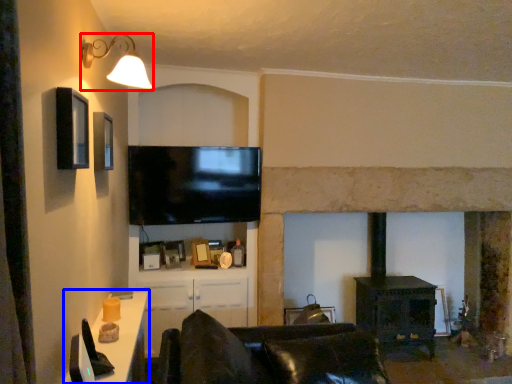
Question: Among these objects, which one is farthest to the camera, light fixture (highlighted by a red box) or table (highlighted by a blue box)?

Choices:
 (A) light fixture
 (B) table

Answer: (A)